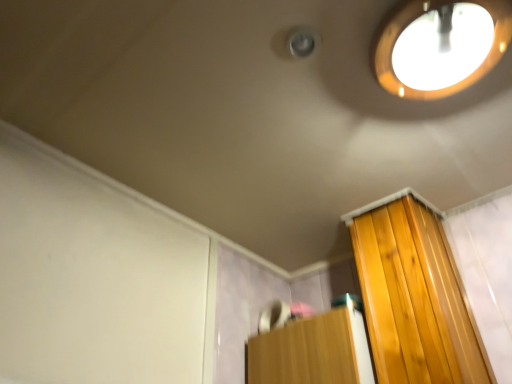
Question: Can we say matte wooden droplight at upper right lies outside white matte screen door at upper left?

Choices:
 (A) yes
 (B) no

Answer: (A)

Question: Does matte wooden droplight at upper right appear on the left side of white matte screen door at upper left?

Choices:
 (A) yes
 (B) no

Answer: (B)

Question: Is matte wooden droplight at upper right to the right of white matte screen door at upper left from the viewer's perspective?

Choices:
 (A) no
 (B) yes

Answer: (B)

Question: From a real-world perspective, is matte wooden droplight at upper right located higher than white matte screen door at upper left?

Choices:
 (A) yes
 (B) no

Answer: (A)

Question: Does matte wooden droplight at upper right have a lesser height compared to white matte screen door at upper left?

Choices:
 (A) yes
 (B) no

Answer: (A)

Question: From their relative heights in the image, would you say matte wooden droplight at upper right is taller or shorter than white matte screen door at upper left?

Choices:
 (A) tall
 (B) short

Answer: (B)

Question: Looking at their shapes, would you say matte wooden droplight at upper right is wider or thinner than white matte screen door at upper left?

Choices:
 (A) wide
 (B) thin

Answer: (A)

Question: Is matte wooden droplight at upper right inside or outside of white matte screen door at upper left?

Choices:
 (A) outside
 (B) inside

Answer: (A)

Question: In the image, is matte wooden droplight at upper right on the left side or the right side of white matte screen door at upper left?

Choices:
 (A) right
 (B) left

Answer: (A)

Question: Is white matte screen door at upper left inside the boundaries of matte wooden droplight at upper right, or outside?

Choices:
 (A) inside
 (B) outside

Answer: (B)

Question: From a real-world perspective, relative to matte wooden droplight at upper right, is white matte screen door at upper left vertically above or below?

Choices:
 (A) below
 (B) above

Answer: (A)

Question: Considering the positions of white matte screen door at upper left and matte wooden droplight at upper right in the image, is white matte screen door at upper left taller or shorter than matte wooden droplight at upper right?

Choices:
 (A) tall
 (B) short

Answer: (A)

Question: Looking at their shapes, would you say white matte screen door at upper left is wider or thinner than matte wooden droplight at upper right?

Choices:
 (A) wide
 (B) thin

Answer: (B)

Question: In terms of height, does wooden cabinet at lower right look taller or shorter compared to matte wooden droplight at upper right?

Choices:
 (A) short
 (B) tall

Answer: (B)

Question: Does point (311, 329) appear closer or farther from the camera than point (452, 41)?

Choices:
 (A) farther
 (B) closer

Answer: (A)